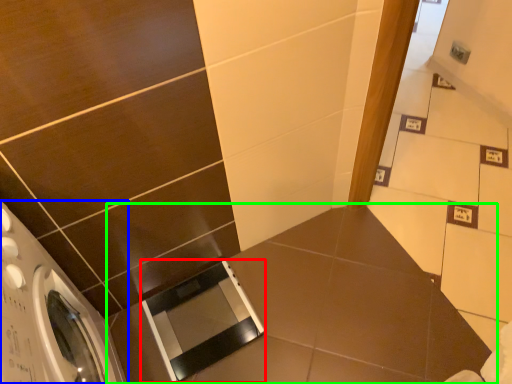
Question: Estimate the real-world distances between objects in this image. Which object is farther from screen door (highlighted by a red box), washing machine (highlighted by a blue box) or counter top (highlighted by a green box)?

Choices:
 (A) washing machine
 (B) counter top

Answer: (A)